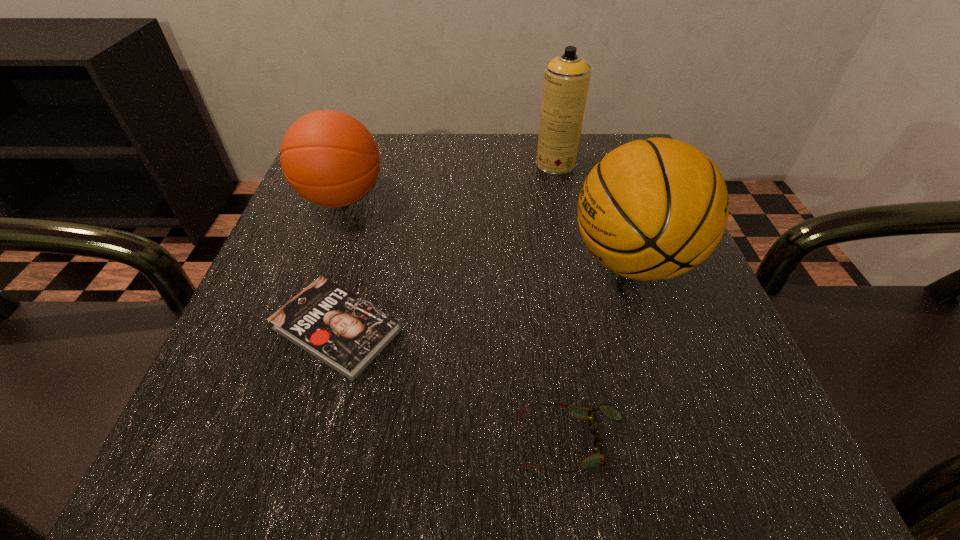
You are a GUI agent. You are given a task and a screenshot of the screen. Output one action in this format:
    pyautogui.click(x=<x>, y=<y>)
    Task: Click on the book at the left edge
    
    Given the screenshot: What is the action you would take?
    pyautogui.click(x=341, y=329)

Locate an element on the screen. aerosol can that is at the right edge is located at coordinates (566, 80).

In order to click on basketball positioned at the right edge in this screenshot , I will do `click(651, 209)`.

Identify the location of object present at the far left corner. The height and width of the screenshot is (540, 960). (329, 158).

Locate an element on the screen. object that is at the far right corner is located at coordinates (566, 80).

What are the coordinates of `free region at the far edge of the desktop` in the screenshot? It's located at (512, 170).

The image size is (960, 540). In order to click on free space at the near edge in this screenshot , I will do tap(490, 464).

The height and width of the screenshot is (540, 960). In the image, there is a desktop. What are the coordinates of `vacant area at the left edge` in the screenshot? It's located at (244, 318).

In the image, there is a desktop. Identify the location of free region at the right edge. (640, 302).

The height and width of the screenshot is (540, 960). I want to click on vacant space at the far left corner, so click(x=388, y=135).